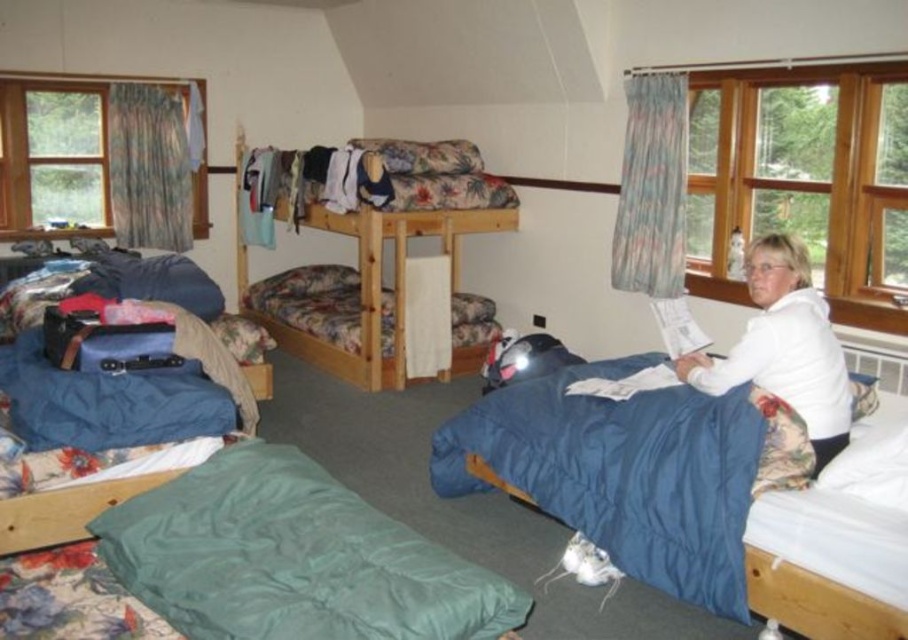
Is point (738, 454) farther from camera compared to point (400, 340)?

No.

Between point (603, 438) and point (406, 227), which one is positioned in front?

Point (603, 438)

Locate an element on the screen. blue quilted bed at lower right is located at coordinates (634, 468).

Which of these two, white soft blanket at lower right or floral fabric bunk bed at upper center, stands taller?

Standing taller between the two is floral fabric bunk bed at upper center.

Can you confirm if white soft blanket at lower right is shorter than floral fabric bunk bed at upper center?

Yes, white soft blanket at lower right is shorter than floral fabric bunk bed at upper center.

Is point (788, 236) behind point (285, 348)?

No.

Where is `white soft blanket at lower right`? white soft blanket at lower right is located at coordinates (785, 348).

Who is shorter, blue quilted bed at lower right or white soft blanket at lower right?

Standing shorter between the two is blue quilted bed at lower right.

Does blue quilted bed at lower right appear on the right side of white soft blanket at lower right?

No, blue quilted bed at lower right is not to the right of white soft blanket at lower right.

Between point (706, 557) and point (768, 298), which one is positioned behind?

The point (768, 298) is more distant.

Locate an element on the screen. The image size is (908, 640). blue quilted bed at lower right is located at coordinates (634, 468).